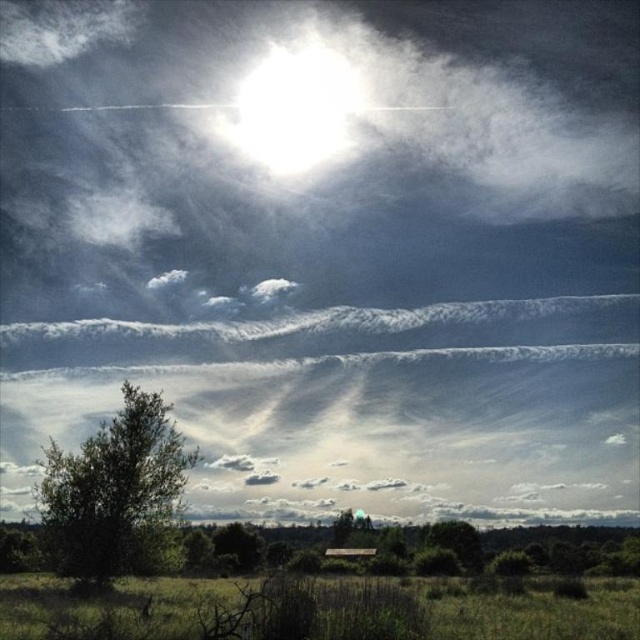
Question: Which point is closer to the camera?

Choices:
 (A) green leafy tree at lower left
 (B) green grassy field at lower center
 (C) white glossy sun at upper center

Answer: (B)

Question: Is green leafy tree at lower left closer to camera compared to white glossy sun at upper center?

Choices:
 (A) yes
 (B) no

Answer: (A)

Question: Is green grassy field at lower center thinner than white glossy sun at upper center?

Choices:
 (A) no
 (B) yes

Answer: (A)

Question: Can you confirm if green grassy field at lower center is positioned to the left of white glossy sun at upper center?

Choices:
 (A) yes
 (B) no

Answer: (B)

Question: Which point is farther to the camera?

Choices:
 (A) green leafy tree at lower left
 (B) green grassy field at lower center

Answer: (A)

Question: Considering the real-world distances, which object is closest to the green leafy tree at lower left?

Choices:
 (A) white glossy sun at upper center
 (B) green grassy field at lower center

Answer: (B)